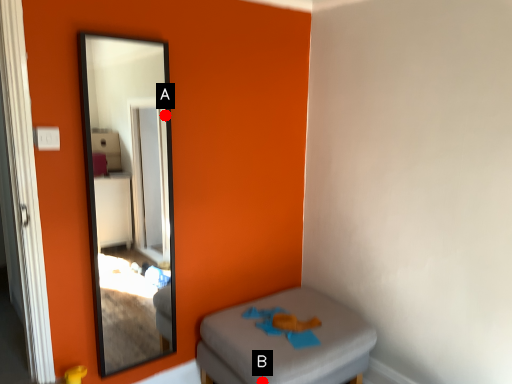
Question: Two points are circled on the image, labeled by A and B beside each circle. Which point is closer to the camera?

Choices:
 (A) A is closer
 (B) B is closer

Answer: (B)